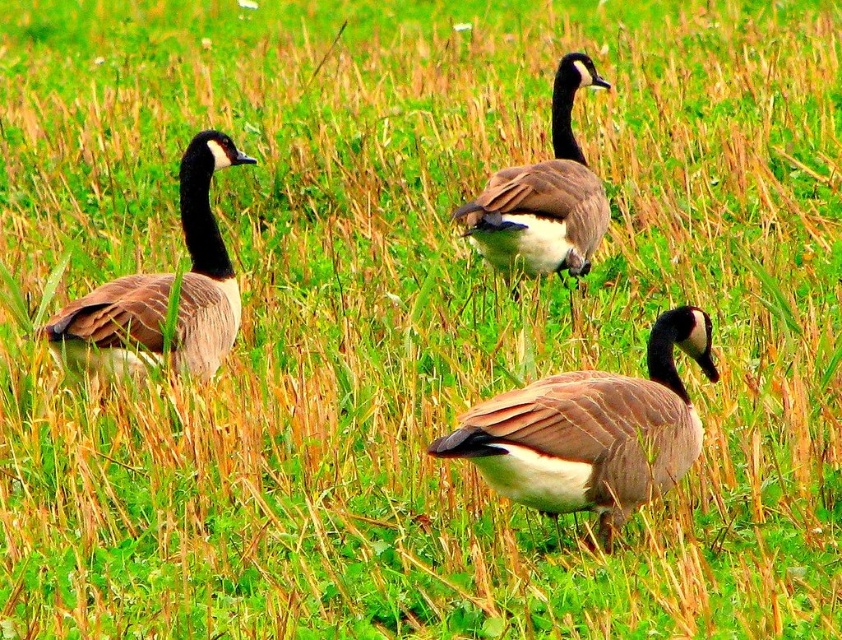
What are the coordinates of the brown matte duck at center in the image?

The coordinates of the brown matte duck at center are at point [590,429].

You are a wildlife photographer aiming to capture a photo of the brown matte duck at center and the brown matte duck at left. If you want to ensure both ducks are in focus, which duck should you focus on first considering their sizes?

The brown matte duck at center is larger in width than the brown matte duck at left, so focusing on the brown matte duck at center first would help ensure both are in focus as it is closer to the camera.

You are a wildlife photographer aiming to capture a closeup of the brown matte duck at center and the brown matte goose at center. Given that your camera lens can only focus on objects within a 1.5 meter width, can both birds fit in the frame without moving the camera?

The brown matte duck at center is wider than the brown matte goose at center. However, the total width of both birds combined would exceed the 1.5 meter limit, so only one can fit at a time.